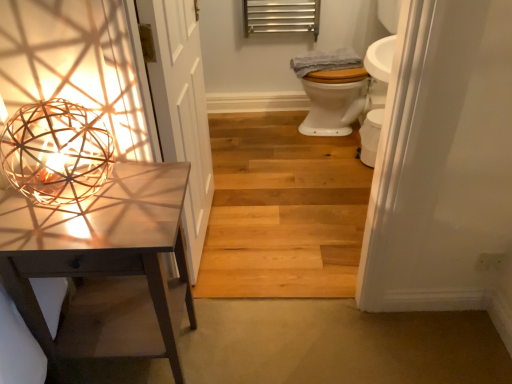
You are a GUI agent. You are given a task and a screenshot of the screen. Output one action in this format:
    pyautogui.click(x=<x>, y=<y>)
    Task: Click on the free space behind woven wood sphere at left
    This screenshot has width=512, height=384.
    Given the screenshot: What is the action you would take?
    pyautogui.click(x=112, y=177)